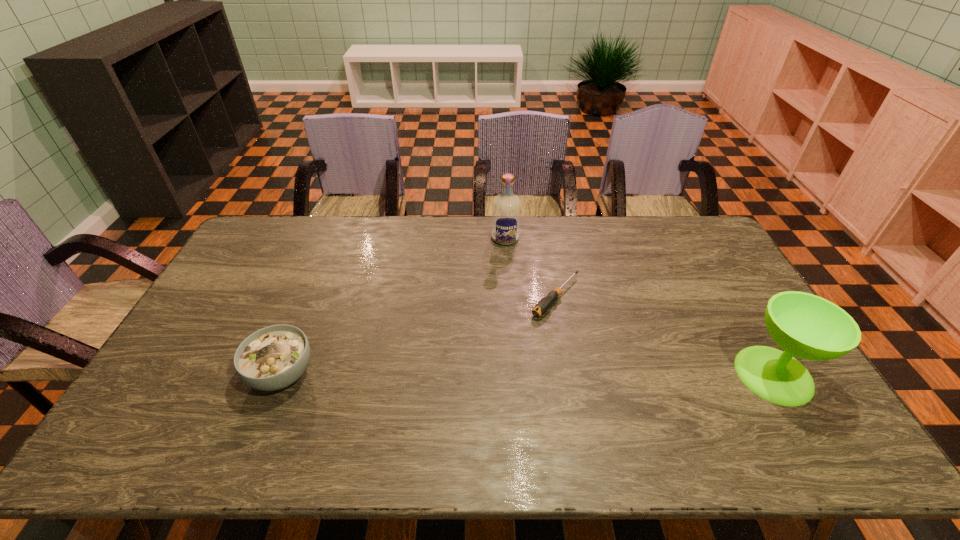
Image resolution: width=960 pixels, height=540 pixels. In order to click on object located in the near right corner section of the desktop in this screenshot , I will do `click(804, 325)`.

This screenshot has height=540, width=960. In order to click on free location at the far edge of the desktop in this screenshot , I will do `click(669, 252)`.

At what (x,y) coordinates should I click in order to perform the action: click on vacant space at the near edge of the desktop. Please return your answer as a coordinate pair (x, y). This screenshot has height=540, width=960. Looking at the image, I should click on (288, 402).

The height and width of the screenshot is (540, 960). In the image, there is a desktop. What are the coordinates of `free region at the left edge` in the screenshot? It's located at (231, 266).

Identify the location of vacant space at the right edge. (693, 285).

In the image, there is a desktop. At what (x,y) coordinates should I click in order to perform the action: click on vacant space at the far left corner. Please return your answer as a coordinate pair (x, y). Looking at the image, I should click on (281, 226).

Find the location of a particular element. The width and height of the screenshot is (960, 540). free space at the far right corner of the desktop is located at coordinates tap(671, 216).

Find the location of `blank region between the screwdriver and the soup bowl`. blank region between the screwdriver and the soup bowl is located at coordinates (419, 335).

Identify the location of free space between the second shortest object and the rightmost object. (528, 374).

Where is `free space between the vodka and the screwdriver`? This screenshot has width=960, height=540. free space between the vodka and the screwdriver is located at coordinates (531, 267).